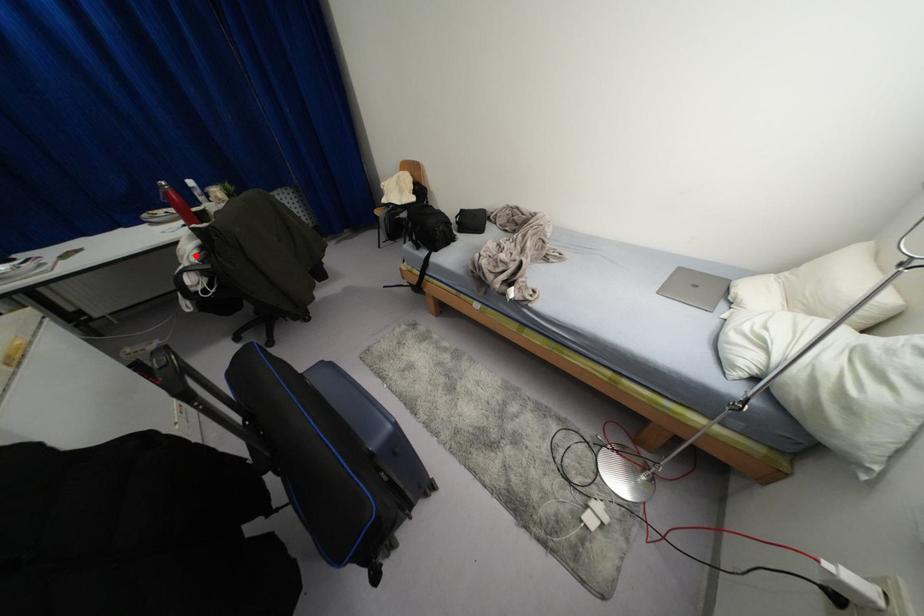
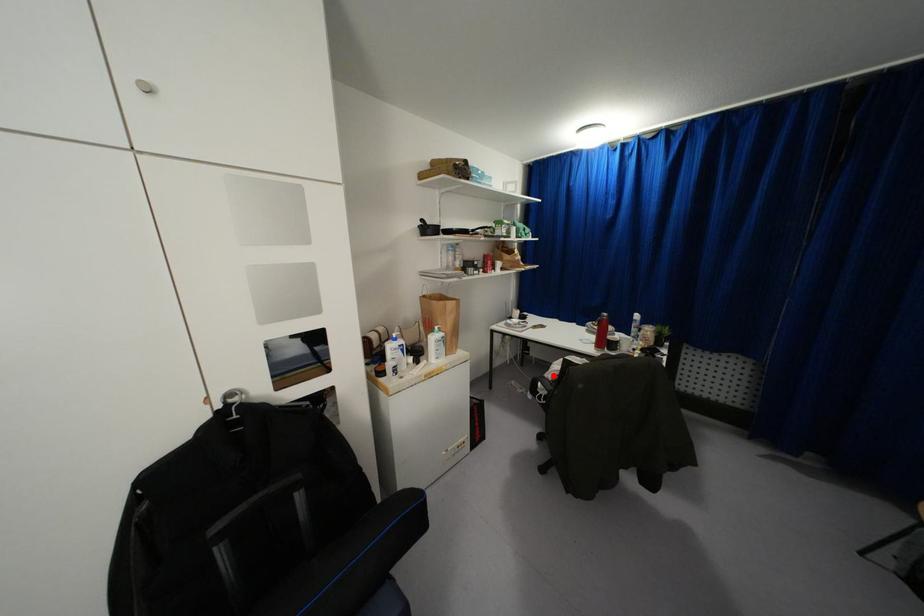
I am providing you with two images of the same scene from different viewpoints. A red point is marked on the first image and another point is marked on the second image. Does the point marked in image1 correspond to the same location as the one in image2?

Yes